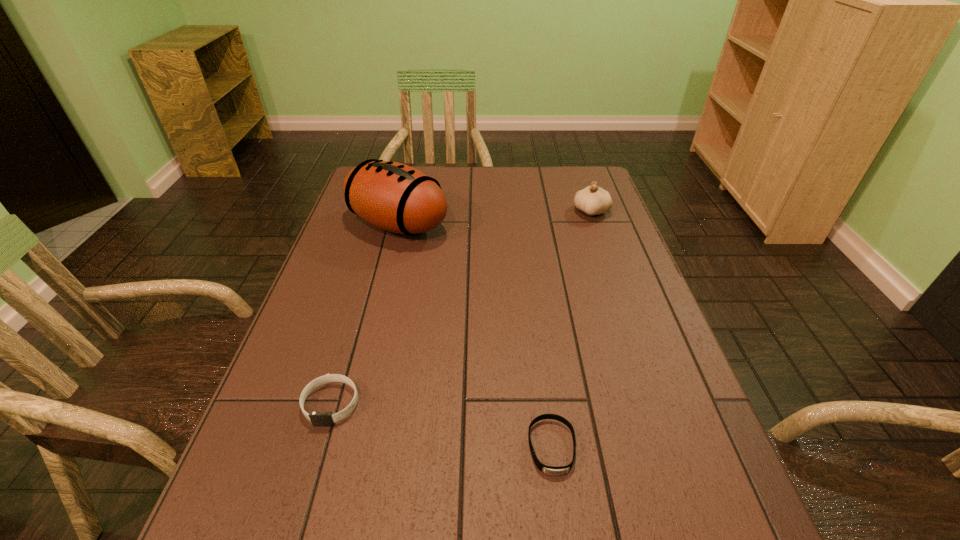
Find the location of a particular element. The width and height of the screenshot is (960, 540). the second closest object to the third shortest object is located at coordinates point(550,470).